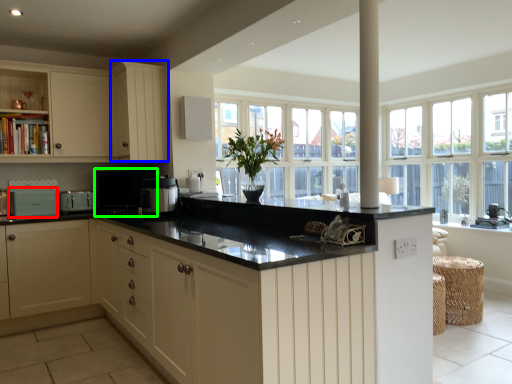
Question: Which is farther away from appliance (highlighted by a red box)? cabinetry (highlighted by a blue box) or appliance (highlighted by a green box)?

Choices:
 (A) cabinetry
 (B) appliance

Answer: (A)